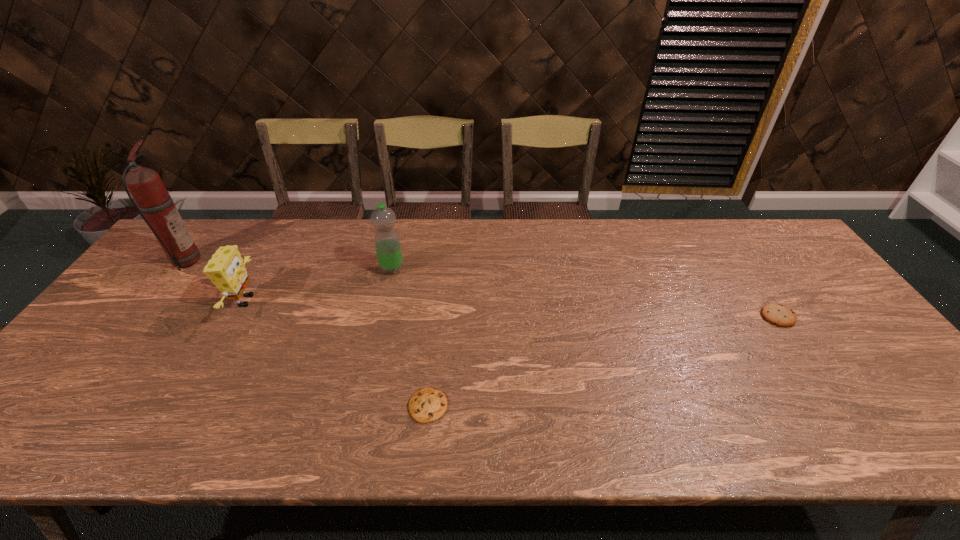
You are a GUI agent. You are given a task and a screenshot of the screen. Output one action in this format:
    pyautogui.click(x=<x>, y=<y>)
    Task: Click on the vacant position located 0.090m on the side of the fire extinguisher with the label and nozzle
    The image size is (960, 540).
    Given the screenshot: What is the action you would take?
    pyautogui.click(x=229, y=261)

What are the coordinates of `vacant region located 0.330m on the right of the third object from left to right` in the screenshot? It's located at (513, 269).

At what (x,y) coordinates should I click in order to perform the action: click on free region located 0.280m on the face of the third tallest object. Please return your answer as a coordinate pair (x, y). Image resolution: width=960 pixels, height=540 pixels. Looking at the image, I should click on (358, 301).

What are the coordinates of `free space located on the right of the fourth tallest object` in the screenshot? It's located at 834,316.

Identify the location of free region located 0.290m on the back of the shortest object. The height and width of the screenshot is (540, 960). click(x=439, y=301).

I want to click on fire extinguisher that is at the far edge, so click(x=152, y=200).

The width and height of the screenshot is (960, 540). I want to click on water bottle present at the far edge, so click(x=387, y=243).

In order to click on object situated at the near edge in this screenshot , I will do `click(426, 405)`.

I want to click on object that is at the left edge, so click(152, 200).

At what (x,y) coordinates should I click in order to perform the action: click on object present at the right edge. Please return your answer as a coordinate pair (x, y). Looking at the image, I should click on (780, 315).